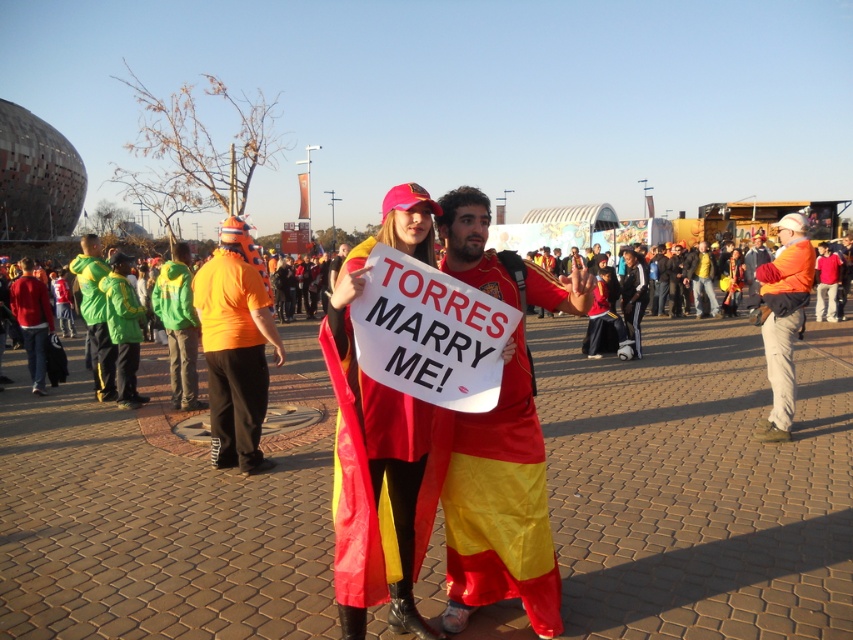
Based on the photo, you are a photographer at the event and want to capture both the orange fabric jacket at center and the green fabric jacket at left in a single frame. Which jacket should you focus on to ensure both are in the frame without moving the camera?

The orange fabric jacket at center is smaller than the green fabric jacket at left, so focusing on the orange fabric jacket at center would allow both jackets to fit within the frame since it requires less space.